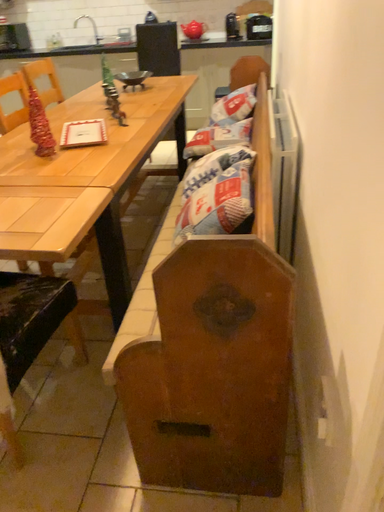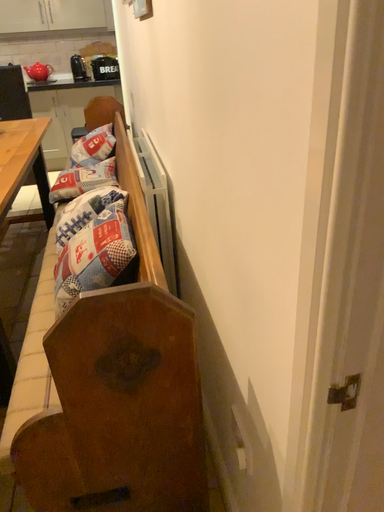
Question: Which way did the camera rotate in the video?

Choices:
 (A) rotated left
 (B) rotated right

Answer: (B)